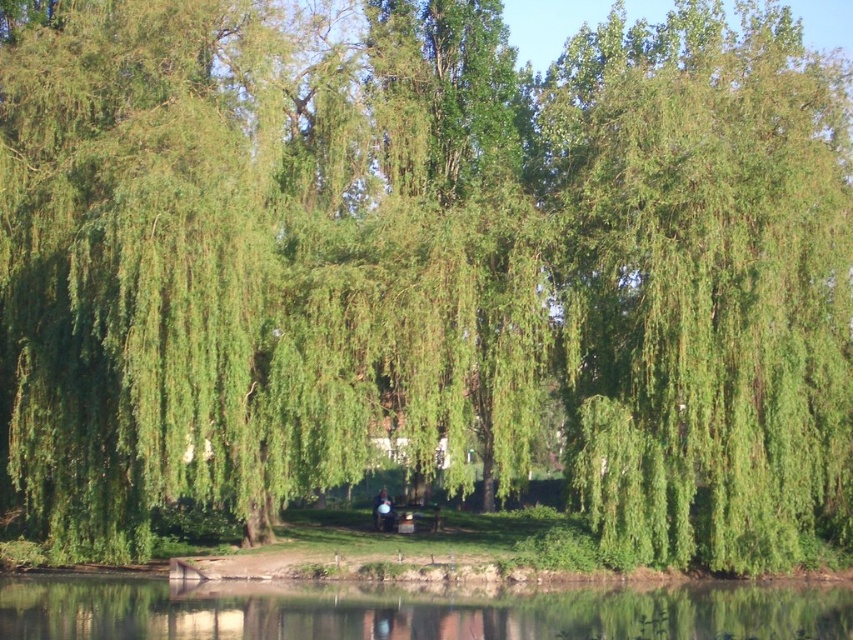
Can you confirm if green leafy willow at upper right is smaller than smooth skin person at center?

Actually, green leafy willow at upper right might be larger than smooth skin person at center.

Which is more to the left, green leafy willow at upper right or smooth skin person at center?

From the viewer's perspective, smooth skin person at center appears more on the left side.

Based on the photo, measure the distance between point (751, 234) and camera.

A distance of 112.79 feet exists between point (751, 234) and camera.

At what (x,y) coordinates should I click in order to perform the action: click on green leafy willow at upper right. Please return your answer as a coordinate pair (x, y). This screenshot has height=640, width=853. Looking at the image, I should click on (704, 284).

Which of these two, green leafy willow at upper right or transparent water at bottom, stands shorter?

With less height is transparent water at bottom.

Which is more to the left, green leafy willow at upper right or transparent water at bottom?

Positioned to the left is transparent water at bottom.

Between point (643, 433) and point (404, 600), which one is positioned in front?

Positioned in front is point (404, 600).

The width and height of the screenshot is (853, 640). In order to click on green leafy willow at upper right in this screenshot , I will do `click(704, 284)`.

Who is lower down, transparent water at bottom or smooth skin person at center?

transparent water at bottom is lower down.

Looking at this image, which of these two, transparent water at bottom or smooth skin person at center, stands taller?

With more height is smooth skin person at center.

Locate an element on the screen. The height and width of the screenshot is (640, 853). transparent water at bottom is located at coordinates (413, 612).